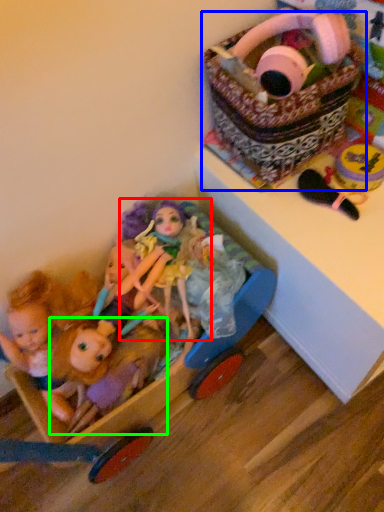
Question: Which object is positioned farthest from doll (highlighted by a red box)? Select from basket (highlighted by a blue box) and doll (highlighted by a green box).

Choices:
 (A) basket
 (B) doll

Answer: (A)